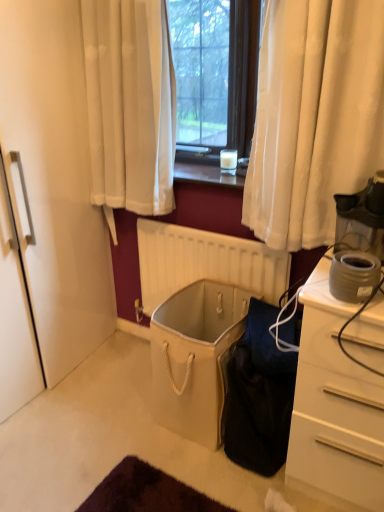
Identify the location of free point above beige matte radiator at center (from a real-world perspective). The image size is (384, 512). (201, 228).